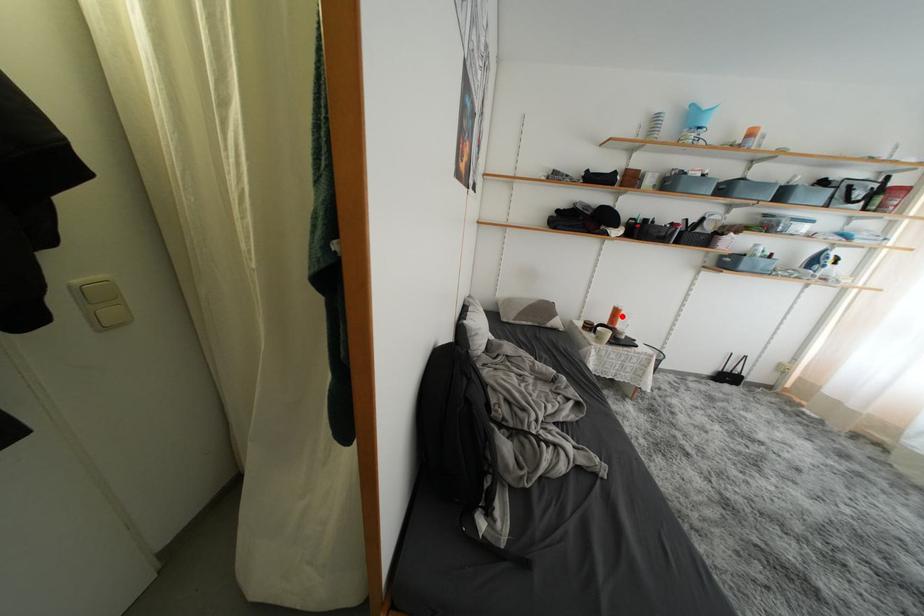
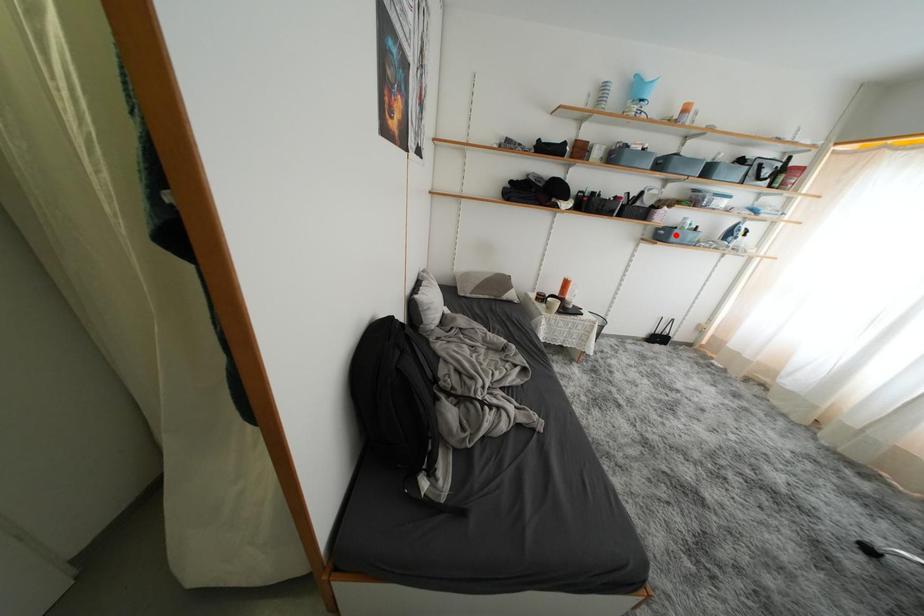
I am providing you with two images of the same scene from different viewpoints. A red point is marked on the first image and another point is marked on the second image. Do the highlighted points in image1 and image2 indicate the same real-world spot?

No